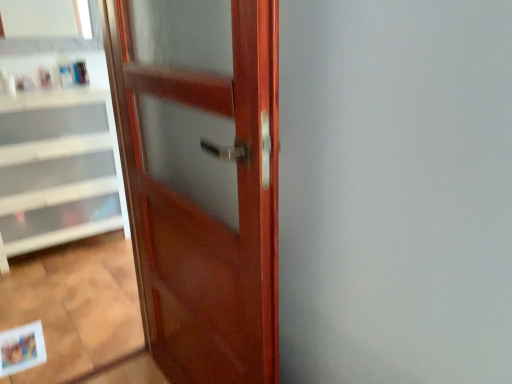
Locate an element on the screen. Image resolution: width=512 pixels, height=384 pixels. unoccupied region to the right of translucent plastic bottle at upper left, the 2th toiletry in the right-to-left sequence is located at coordinates (89, 86).